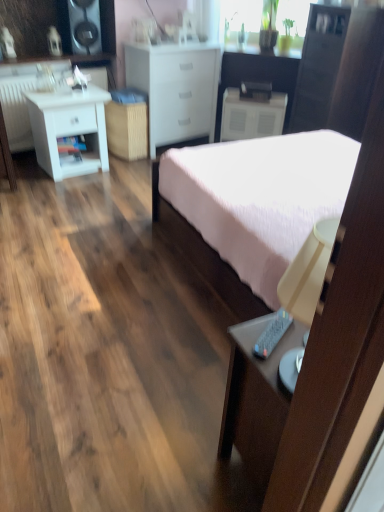
This screenshot has height=512, width=384. Find the location of `free space in front of white matte nightstand at left, arranged as the 2th nightstand when viewed from the back`. free space in front of white matte nightstand at left, arranged as the 2th nightstand when viewed from the back is located at coordinates (56, 184).